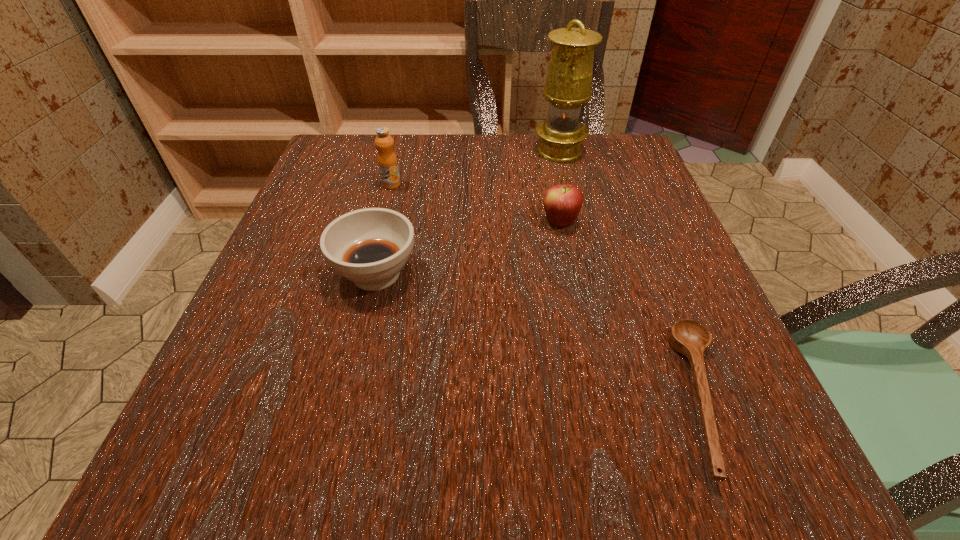
The height and width of the screenshot is (540, 960). I want to click on object at the far left corner, so click(387, 161).

Identify the location of object present at the far right corner. (568, 85).

Where is `object at the near right corner`? The height and width of the screenshot is (540, 960). object at the near right corner is located at coordinates (687, 337).

The image size is (960, 540). I want to click on free point at the far edge, so click(x=527, y=137).

Image resolution: width=960 pixels, height=540 pixels. I want to click on vacant space at the near edge of the desktop, so click(621, 498).

Identify the location of vacant space at the left edge. (227, 340).

Locate an element on the screen. The width and height of the screenshot is (960, 540). free region at the right edge of the desktop is located at coordinates (613, 190).

Image resolution: width=960 pixels, height=540 pixels. Find the location of `free space at the far left corner`. free space at the far left corner is located at coordinates (370, 146).

Identify the location of free space at the far right corner of the desktop. (590, 154).

I want to click on empty space that is in between the farthest object and the second farthest object, so click(475, 168).